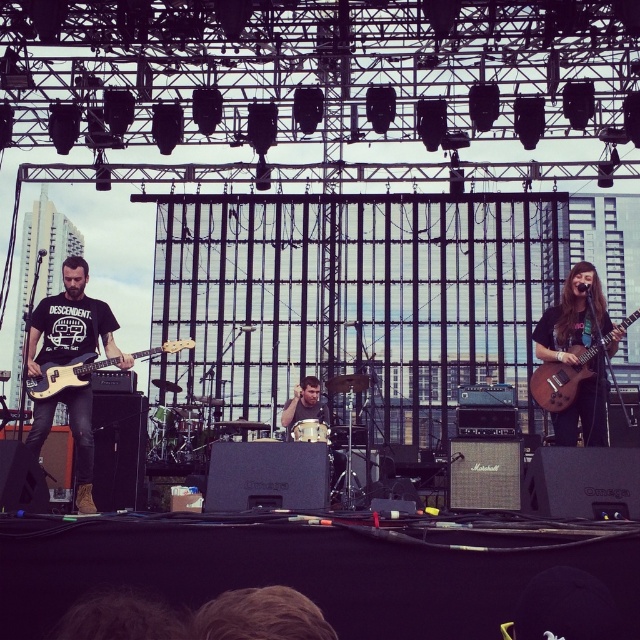
Does matte black t-shirt at left have a lesser width compared to matte black bass guitar at left?

Yes.

In the scene shown: Which is above, matte black t-shirt at left or matte black bass guitar at left?

Positioned higher is matte black t-shirt at left.

Is point (35, 369) farther from camera compared to point (192, 346)?

Yes, point (35, 369) is behind point (192, 346).

This screenshot has height=640, width=640. In order to click on matte black t-shirt at left in this screenshot , I will do `click(72, 323)`.

Can you confirm if matte black t-shirt at left is positioned to the left of smooth drum set at center?

Indeed, matte black t-shirt at left is positioned on the left side of smooth drum set at center.

Identify the location of matte black t-shirt at left. (72, 323).

Who is shorter, brown wooden guitar at right or matte black bass guitar at left?

matte black bass guitar at left is shorter.

Is point (568, 392) closer to camera compared to point (54, 396)?

No, (568, 392) is behind (54, 396).

Between point (564, 362) and point (68, 365), which one is positioned in front?

Point (68, 365) is in front.

Locate an element on the screen. The image size is (640, 640). brown wooden guitar at right is located at coordinates (561, 378).